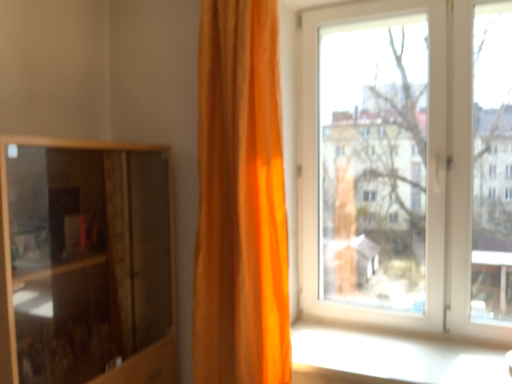
Question: Can you confirm if white glossy window sill at lower right is bigger than white plastic window at upper right?

Choices:
 (A) yes
 (B) no

Answer: (B)

Question: Is white glossy window sill at lower right positioned before white plastic window at upper right?

Choices:
 (A) no
 (B) yes

Answer: (B)

Question: Considering the relative sizes of white glossy window sill at lower right and white plastic window at upper right in the image provided, is white glossy window sill at lower right shorter than white plastic window at upper right?

Choices:
 (A) no
 (B) yes

Answer: (B)

Question: Considering the relative sizes of white glossy window sill at lower right and white plastic window at upper right in the image provided, is white glossy window sill at lower right taller than white plastic window at upper right?

Choices:
 (A) yes
 (B) no

Answer: (B)

Question: Is white glossy window sill at lower right further to camera compared to white plastic window at upper right?

Choices:
 (A) no
 (B) yes

Answer: (A)

Question: Is white glossy window sill at lower right far from white plastic window at upper right?

Choices:
 (A) no
 (B) yes

Answer: (A)

Question: Is orange fabric curtain at center taller than wooden cabinet at left?

Choices:
 (A) yes
 (B) no

Answer: (A)

Question: Does orange fabric curtain at center lie behind wooden cabinet at left?

Choices:
 (A) yes
 (B) no

Answer: (A)

Question: Are orange fabric curtain at center and wooden cabinet at left located far from each other?

Choices:
 (A) yes
 (B) no

Answer: (B)

Question: From the image's perspective, would you say orange fabric curtain at center is positioned over wooden cabinet at left?

Choices:
 (A) yes
 (B) no

Answer: (A)

Question: Is the depth of orange fabric curtain at center less than that of wooden cabinet at left?

Choices:
 (A) no
 (B) yes

Answer: (A)

Question: Considering the relative sizes of orange fabric curtain at center and wooden cabinet at left in the image provided, is orange fabric curtain at center bigger than wooden cabinet at left?

Choices:
 (A) yes
 (B) no

Answer: (B)

Question: From the image's perspective, does white plastic window at upper right appear lower than orange fabric curtain at center?

Choices:
 (A) yes
 (B) no

Answer: (B)